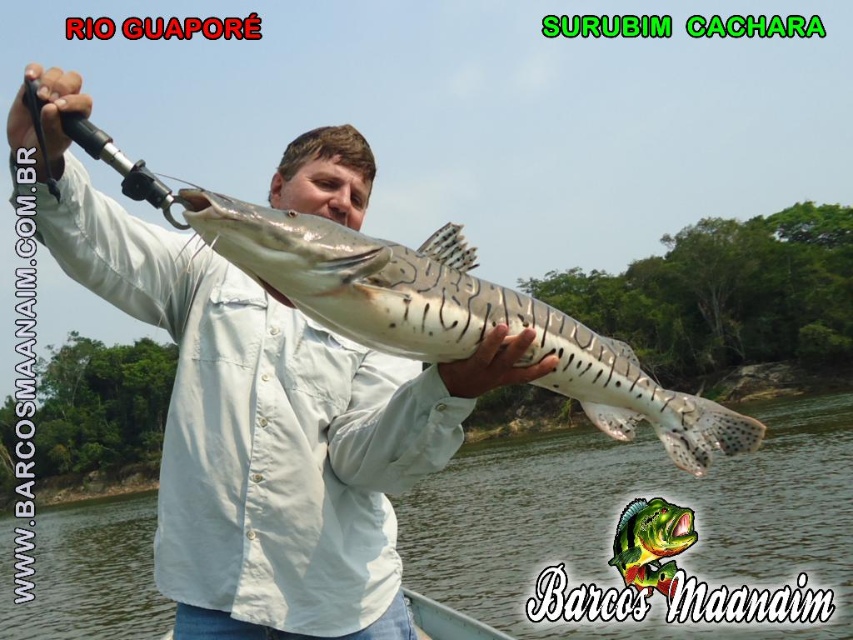
Find the location of a particular element. white matte shirt at center is located at coordinates (259, 417).

Measure the distance between white matte shirt at center and camera.

white matte shirt at center is 2.03 meters from camera.

Locate an element on the screen. The image size is (853, 640). white matte shirt at center is located at coordinates (259, 417).